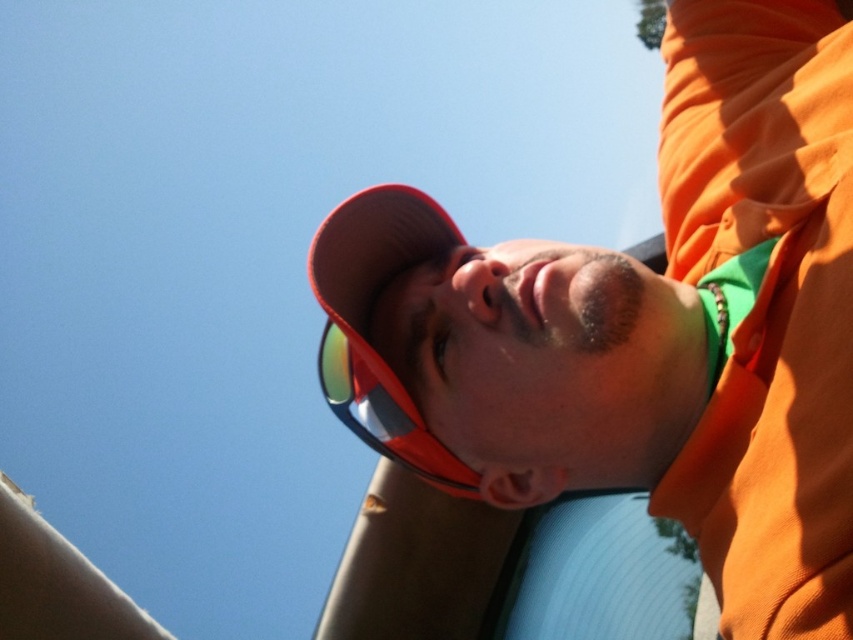
Does matte orange cap at center have a larger size compared to green reflective lens at center?

Yes, matte orange cap at center is bigger than green reflective lens at center.

Can you confirm if matte orange cap at center is wider than green reflective lens at center?

Yes, matte orange cap at center is wider than green reflective lens at center.

Is point (340, 323) positioned in front of point (433, 442)?

Yes, it is.

Find the location of a particular element. matte orange cap at center is located at coordinates (621, 352).